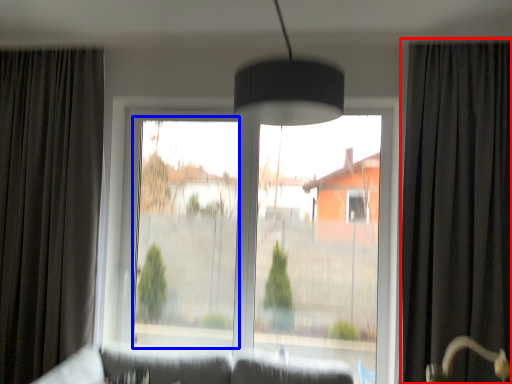
Question: Which of the following is the farthest to the observer, curtain (highlighted by a red box) or window screen (highlighted by a blue box)?

Choices:
 (A) curtain
 (B) window screen

Answer: (B)